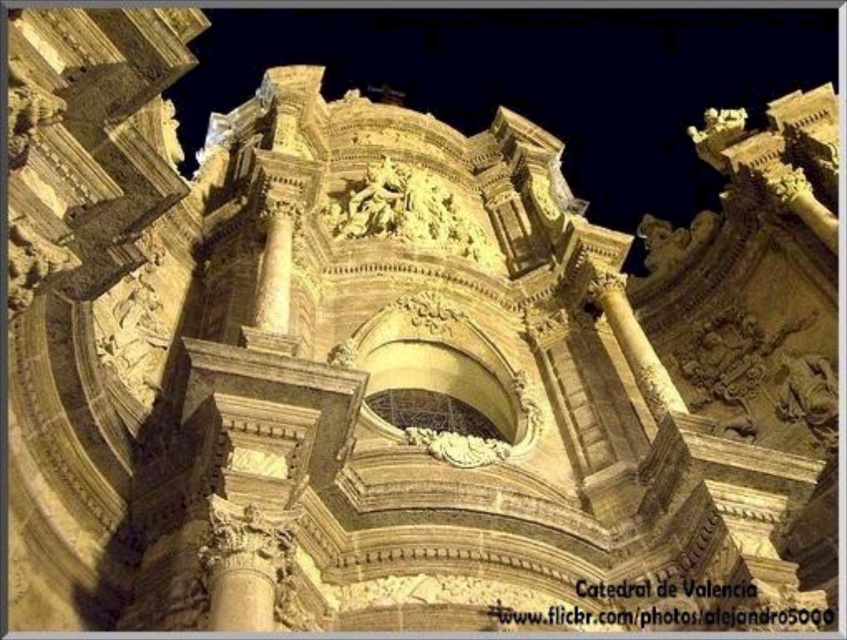
In the scene shown: Looking at the Catedral de Valencia, you notice two golden stone elements. Which one is positioned higher up between the golden stone sculpture at center and the golden stone column at center?

The golden stone sculpture at center is positioned higher up because it is above the golden stone column at center.

You are an architect analyzing the Catedral de Valencia. You observe the golden stone sculpture at center and the golden stone column at center. Which object has a greater width?

The golden stone sculpture at center has a greater width than the golden stone column at center.

From the picture: You are standing in front of the Catedral de Valencia and want to take a photo. You notice two points on the cathedral facade at coordinates point [761,76] and point [258,326]. Which point is closer to your camera lens?

Point [761,76] is further to the viewer than point [258,326], so the point closer to the camera lens is point [258,326].